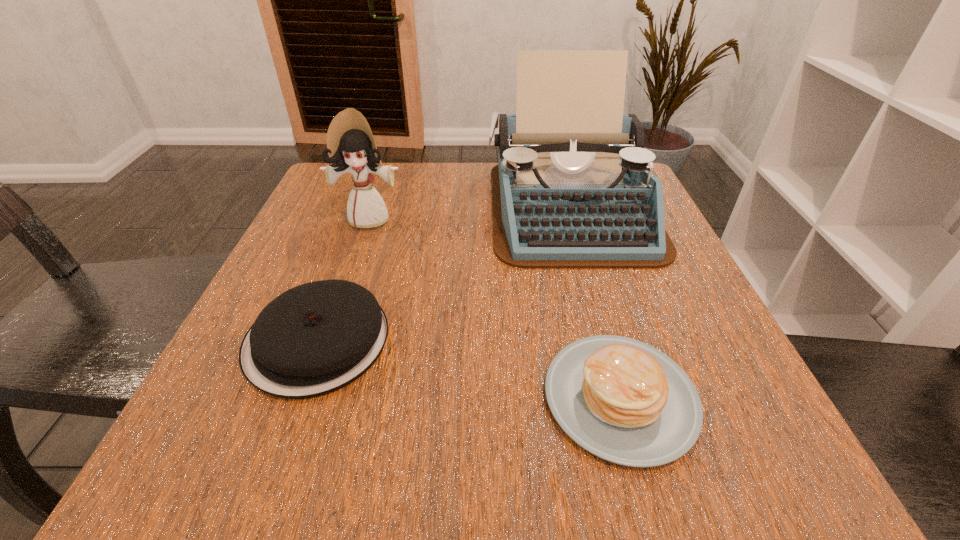
This screenshot has width=960, height=540. Find the location of `typewriter that is at the far edge`. typewriter that is at the far edge is located at coordinates (573, 188).

The height and width of the screenshot is (540, 960). In order to click on doll present at the far edge in this screenshot , I will do `click(350, 144)`.

Where is `object present at the near edge`? object present at the near edge is located at coordinates 624,401.

Image resolution: width=960 pixels, height=540 pixels. Identify the location of doll present at the left edge. (350, 144).

I want to click on pancake that is at the left edge, so click(x=316, y=338).

The image size is (960, 540). I want to click on typewriter positioned at the right edge, so click(573, 188).

The image size is (960, 540). I want to click on pancake that is at the right edge, so click(624, 401).

You are a GUI agent. You are given a task and a screenshot of the screen. Output one action in this format:
    pyautogui.click(x=<x>, y=<y>)
    Task: Click on the object that is at the far left corner
    
    Given the screenshot: What is the action you would take?
    pyautogui.click(x=350, y=144)

Image resolution: width=960 pixels, height=540 pixels. In order to click on object that is at the far right corner in this screenshot , I will do `click(573, 188)`.

Where is `object at the near right corner`? Image resolution: width=960 pixels, height=540 pixels. object at the near right corner is located at coordinates (624, 401).